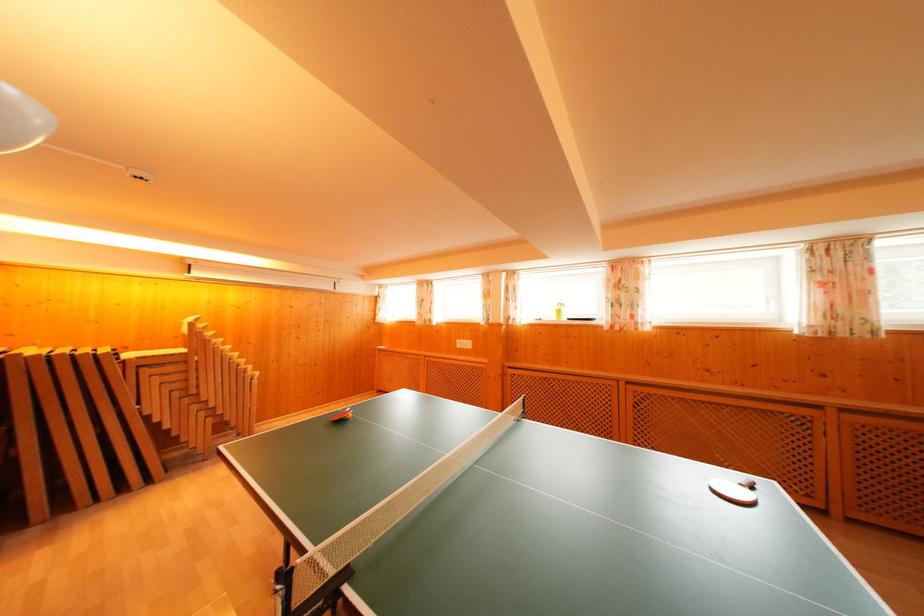
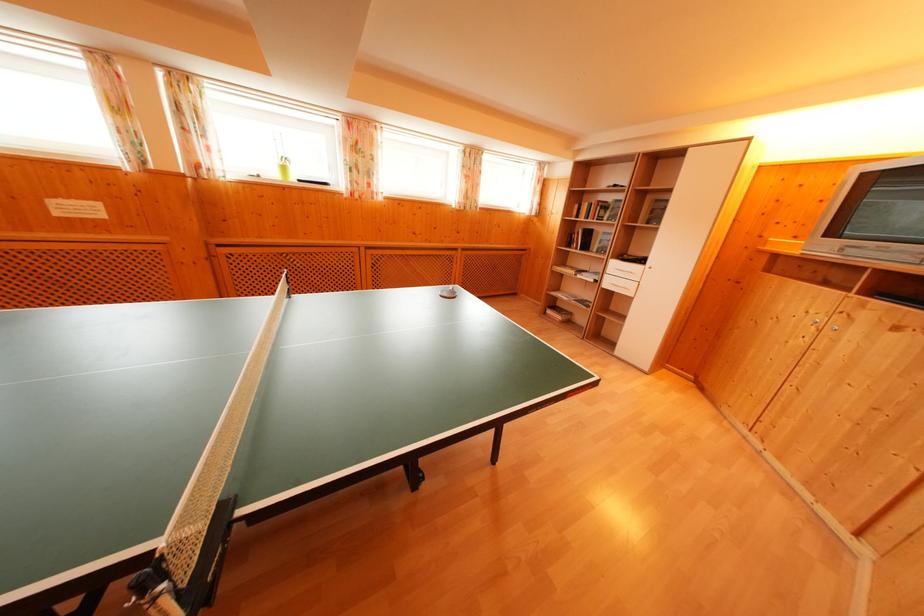
How did the camera likely rotate?

The camera rotated toward right-down.